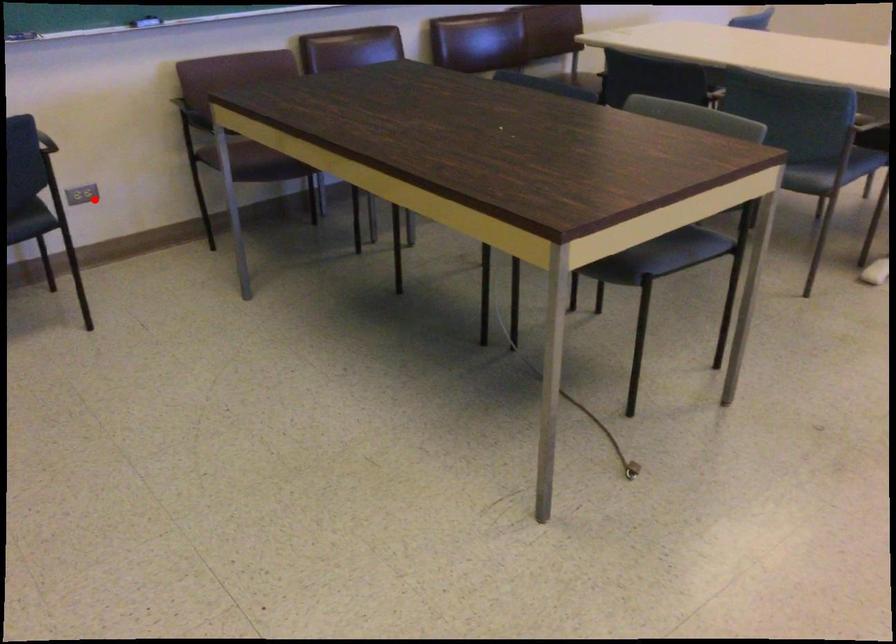
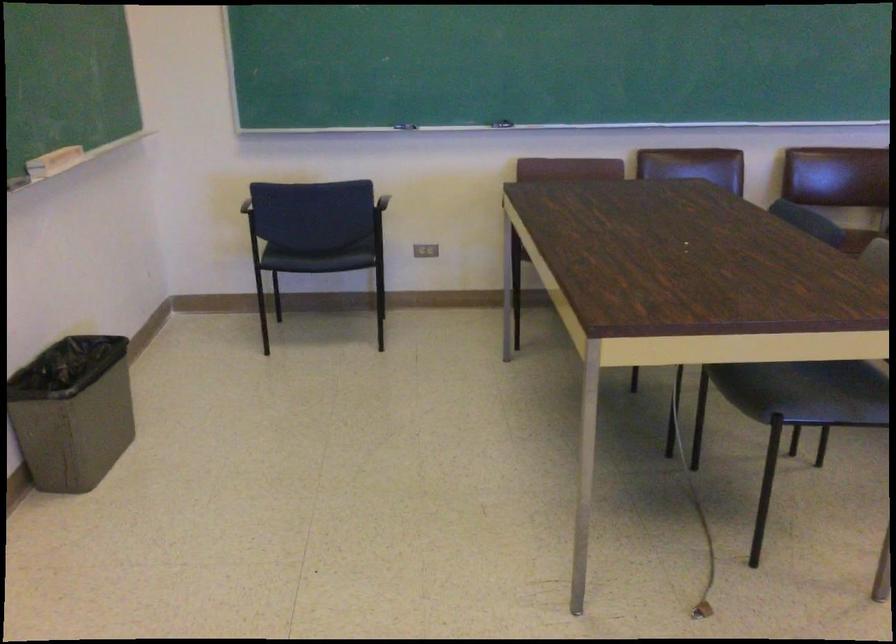
The point at the highlighted location is marked in the first image. Where is the corresponding point in the second image?

(425, 250)